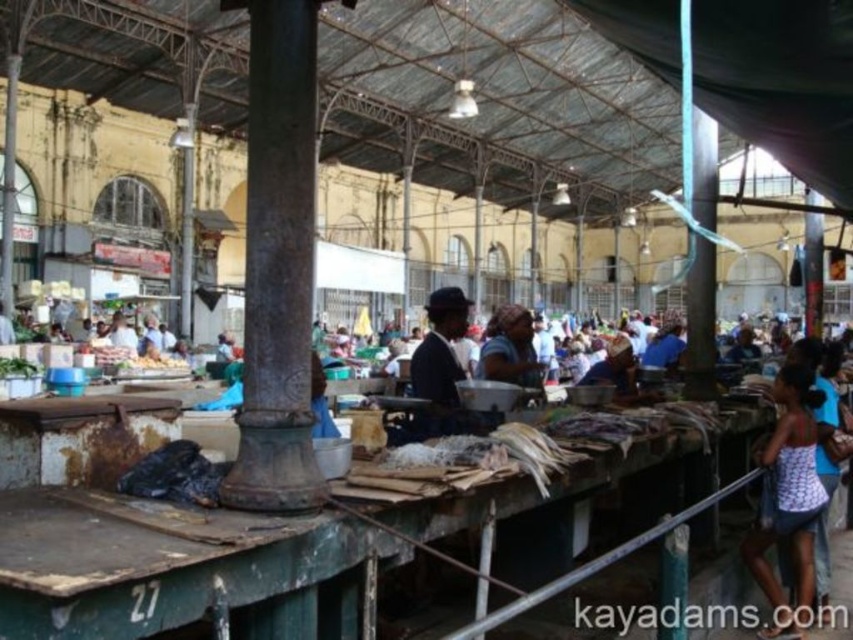
You are a customer at the market and want to buy a white printed tank top at right and a matte black suit at center. Which item is positioned more to the right side of the market?

The white printed tank top at right is positioned to the right of the matte black suit at center, so it is more to the right side of the market.

You are a vendor at the market and need to place a new item between the rusty metal pillar at center and the matte brown headscarf at center. Based on their positions, which object should you place the item closer to if you want it to be on the left side of the headscarf?

You should place the item closer to the rusty metal pillar at center because the rusty metal pillar at center is already to the left of the matte brown headscarf at center, so positioning the item near it would keep it on the left side of the headscarf.

You are a customer at the market and want to buy both the white printed tank top at right and the matte brown headscarf at center. If you are standing at the entrance of the market, which item should you visit first to minimize the total distance walked?

The distance between the white printed tank top at right and the matte brown headscarf at center is 14.16 meters. To minimize the total distance walked, you should visit the item closer to the entrance first. However, the exact location of the entrance relative to the items isn not specified in the provided information, so it is impossible to determine which item is closer without additional details about the market layout.